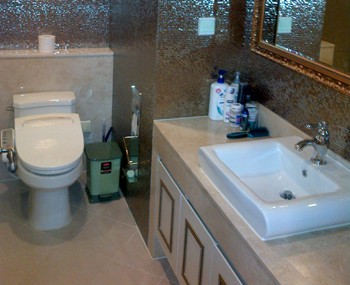
Find the location of `sink`. sink is located at coordinates (267, 200).